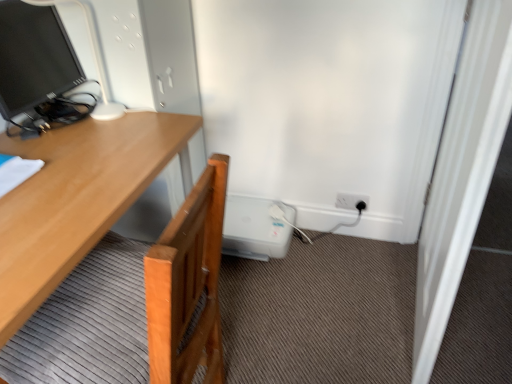
Locate an element on the screen. vacant area that lies to the right of white wooden screen door at right is located at coordinates (481, 301).